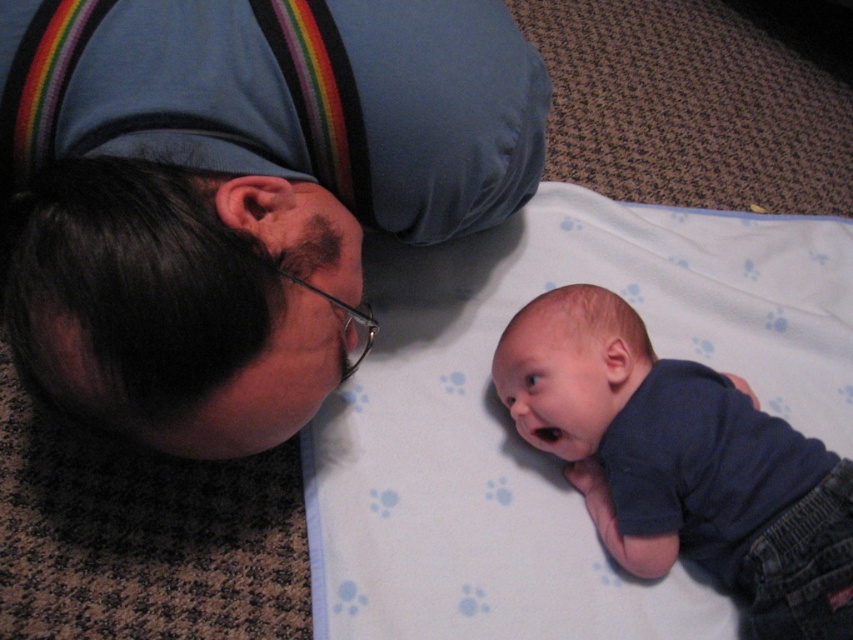
You are standing in the room and see two points marked in the image. Which point is nearer to you, point (202, 8) or point (556, 385)?

Point (202, 8) is closer to the viewer than point (556, 385).

Based on the scene description, which object is wider, the matte black head at upper left or the blue cotton shirt at lower right?

The matte black head at upper left is wider than the blue cotton shirt at lower right according to the description.

You are a photographer setting up for a family portrait. You need to ensure that the matte black head at upper left and the blue cotton shirt at lower right are both clearly visible in the frame. Given their sizes, which object should you prioritize positioning closer to the camera to maintain clarity?

The blue cotton shirt at lower right should be positioned closer to the camera because it is smaller in size compared to the matte black head at upper left, ensuring both objects remain clearly visible in the frame.